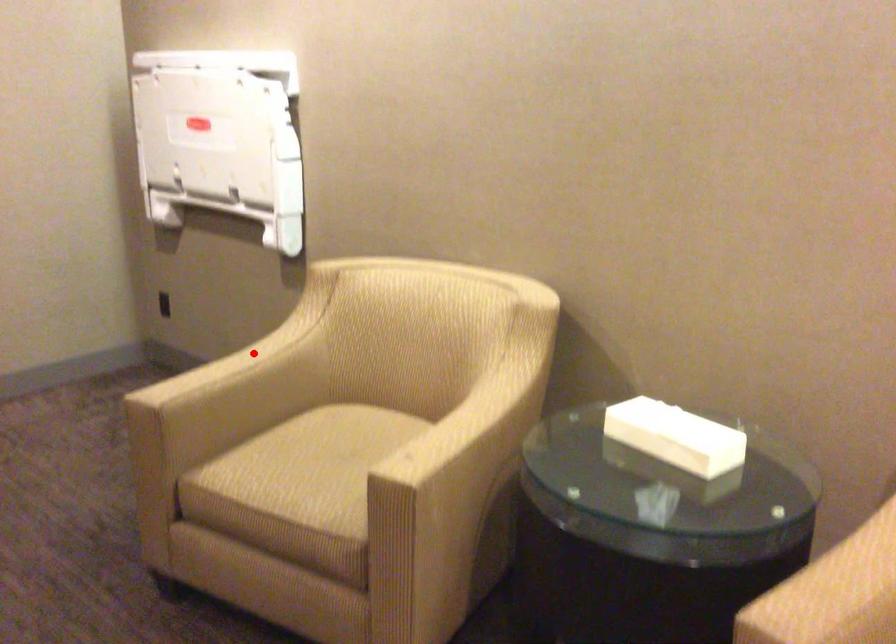
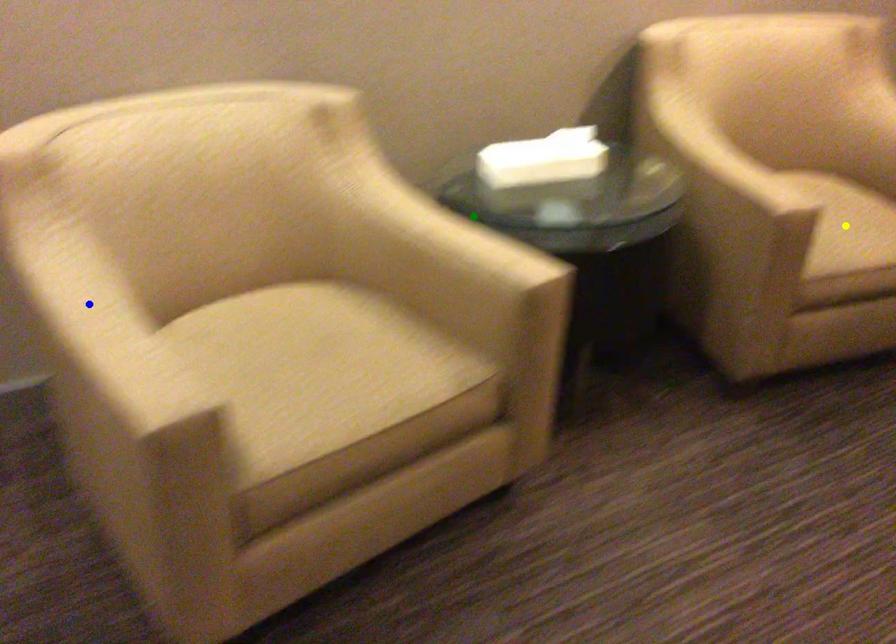
Question: I am providing you with two images of the same scene from different viewpoints. A red point is marked on the first image. You are given multiple points on the second image. Which mark in image 2 goes with the point in image 1?

Choices:
 (A) yellow point
 (B) blue point
 (C) green point

Answer: (B)